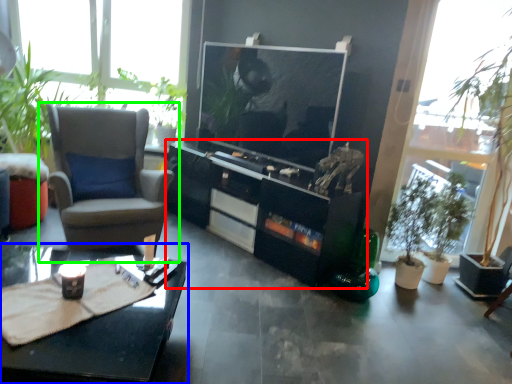
Question: Estimate the real-world distances between objects in this image. Which object is farther from cabinetry (highlighted by a red box), coffee table (highlighted by a blue box) or chair (highlighted by a green box)?

Choices:
 (A) coffee table
 (B) chair

Answer: (A)